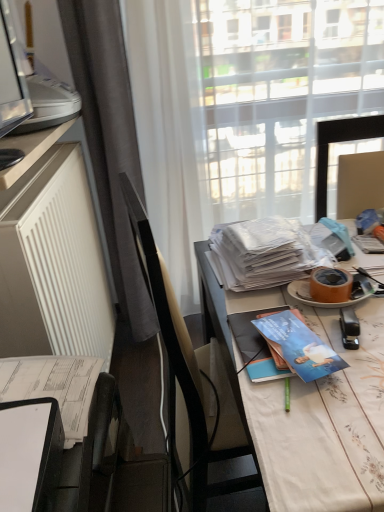
I want to click on free space in front of blue glossy book at center, so [318, 422].